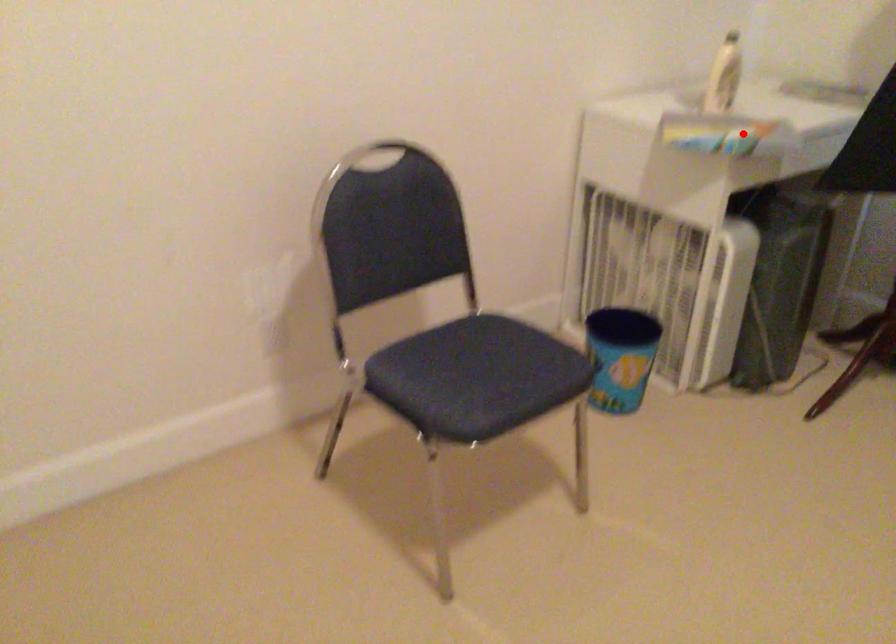
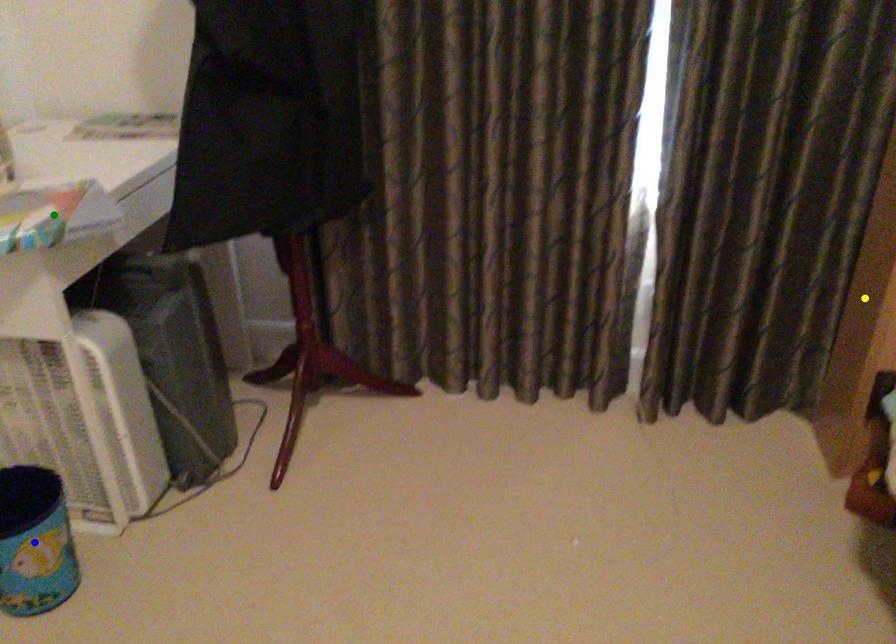
Question: I am providing you with two images of the same scene from different viewpoints. A red point is marked on the first image. You are given multiple points on the second image. Which spot in image 2 lines up with the point in image 1?

Choices:
 (A) blue point
 (B) yellow point
 (C) green point

Answer: (C)